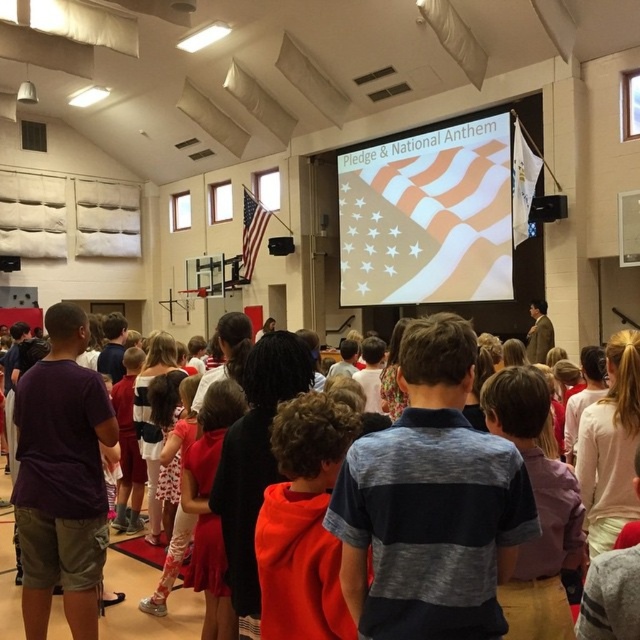
Does matte red dress at center come behind matte american flag at upper center?

No, it is in front of matte american flag at upper center.

Is matte red dress at center to the right of matte american flag at upper center from the viewer's perspective?

Yes, matte red dress at center is to the right of matte american flag at upper center.

Is point (230, 628) in front of point (246, 246)?

Yes, it is in front of point (246, 246).

You are a GUI agent. You are given a task and a screenshot of the screen. Output one action in this format:
    pyautogui.click(x=<x>, y=<y>)
    Task: Click on the matte red dress at center
    This screenshot has width=640, height=640.
    Given the screenshot: What is the action you would take?
    pyautogui.click(x=208, y=506)

Who is taller, gray striped shirt at center or orange hoodie at center?

With more height is orange hoodie at center.

Between point (369, 481) and point (300, 509), which one is positioned behind?

The point (300, 509) is more distant.

Is point (420, 372) positioned behind point (282, 529)?

No, it is not.

Locate an element on the screen. The image size is (640, 640). gray striped shirt at center is located at coordinates (429, 502).

Does white fabric flag at upper center appear on the left side of matte red dress at center?

No, white fabric flag at upper center is not to the left of matte red dress at center.

Between white fabric flag at upper center and matte red dress at center, which one has less height?

matte red dress at center

You are a GUI agent. You are given a task and a screenshot of the screen. Output one action in this format:
    pyautogui.click(x=<x>, y=<y>)
    Task: Click on the white fabric flag at upper center
    The width and height of the screenshot is (640, 640).
    Given the screenshot: What is the action you would take?
    pyautogui.click(x=428, y=216)

Where is `white fabric flag at upper center`? The image size is (640, 640). white fabric flag at upper center is located at coordinates (428, 216).